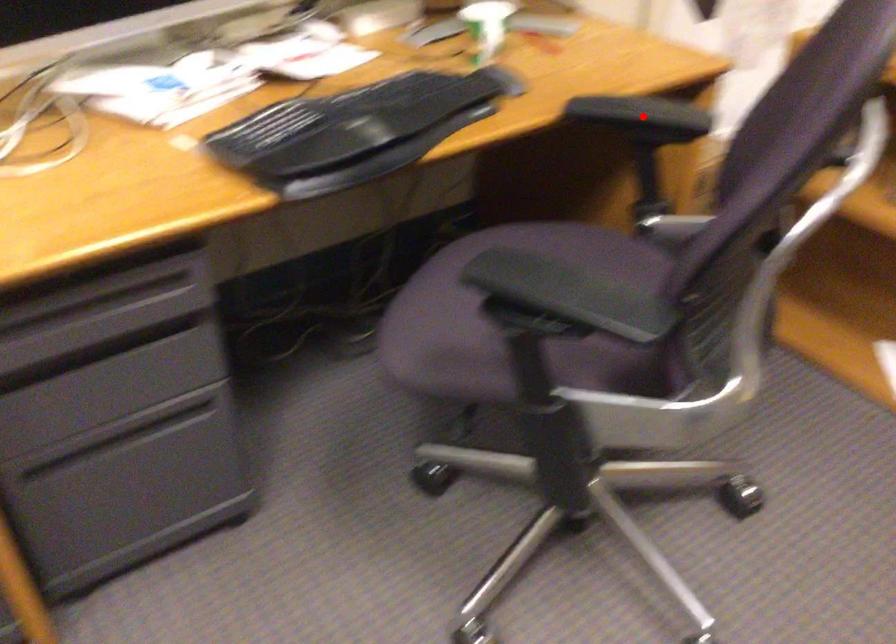
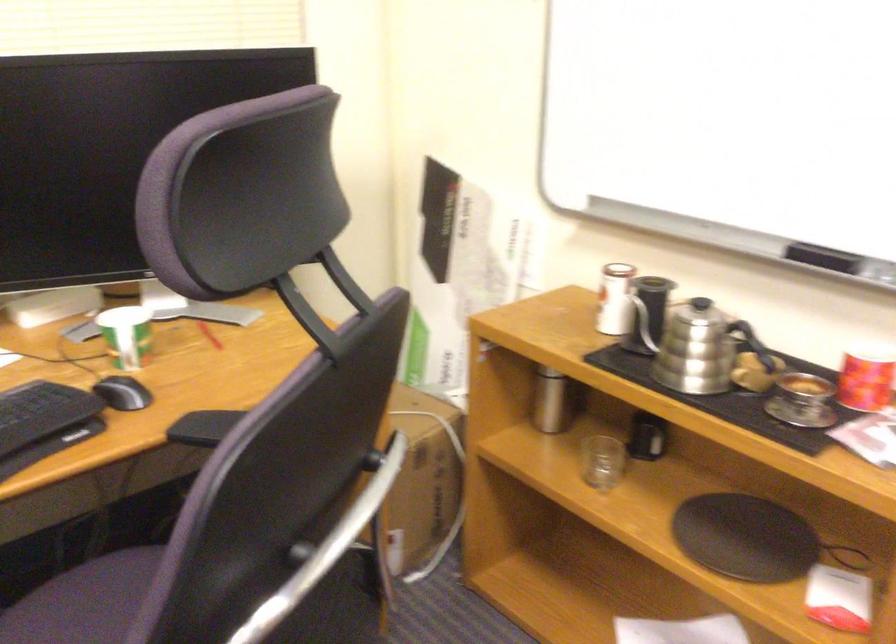
Question: I am providing you with two images of the same scene from different viewpoints. A red point is marked on the first image. At the location where the point appears in image 1, is it still visible in image 2?

Choices:
 (A) Yes
 (B) No

Answer: (B)